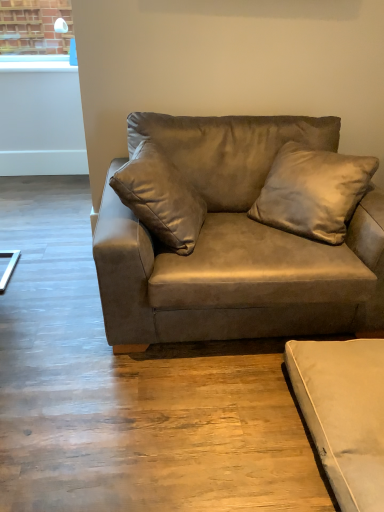
The height and width of the screenshot is (512, 384). I want to click on free point in front of suede brown couch at center, placed as the first studio couch when sorted from top to bottom, so click(x=182, y=423).